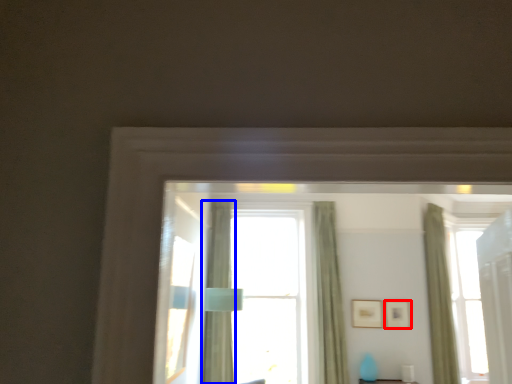
Question: Which object is closer to the camera taking this photo, picture frame (highlighted by a red box) or curtain (highlighted by a blue box)?

Choices:
 (A) picture frame
 (B) curtain

Answer: (B)